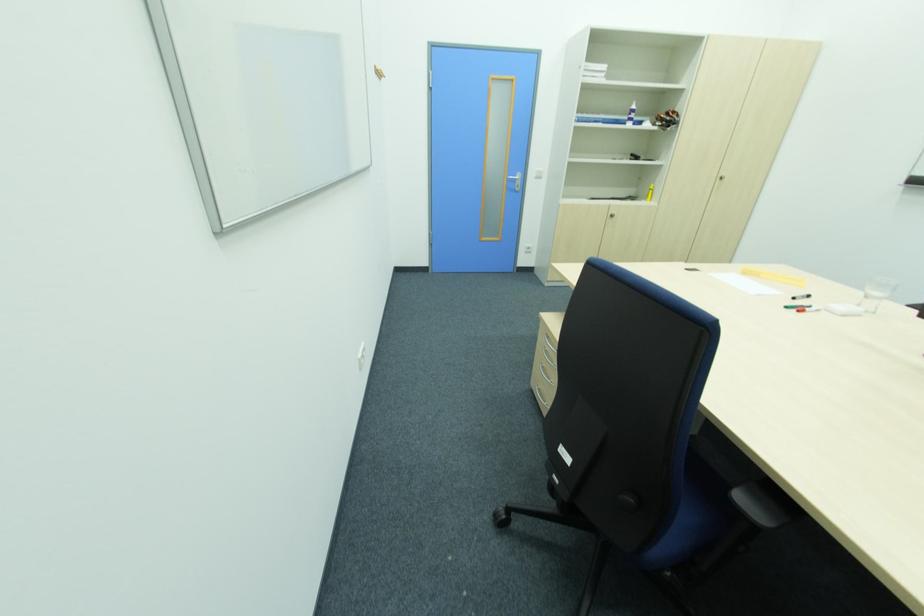
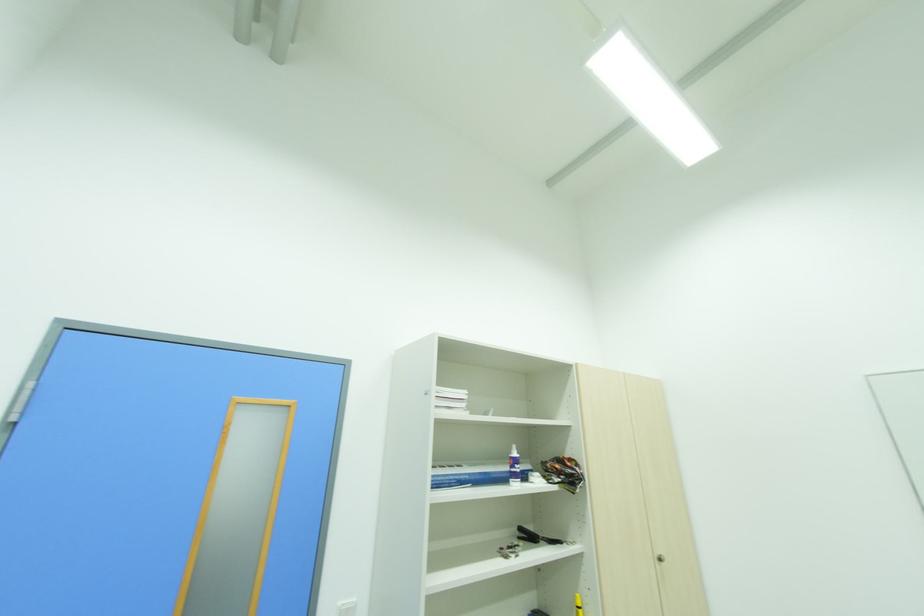
Where in the second image is the point corresponding to point 637,108 from the first image?

(517, 455)